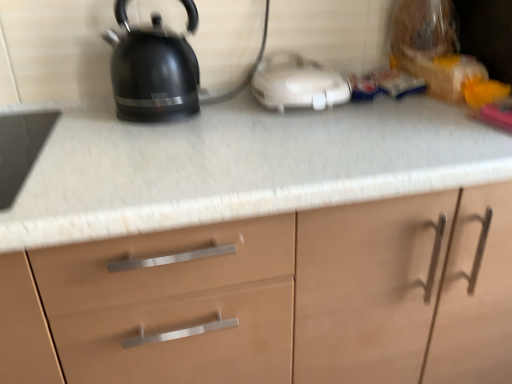
Where is `vacant space situated above matte wood cabinet at center (from a real-world perspective)`? The height and width of the screenshot is (384, 512). vacant space situated above matte wood cabinet at center (from a real-world perspective) is located at coordinates (260, 135).